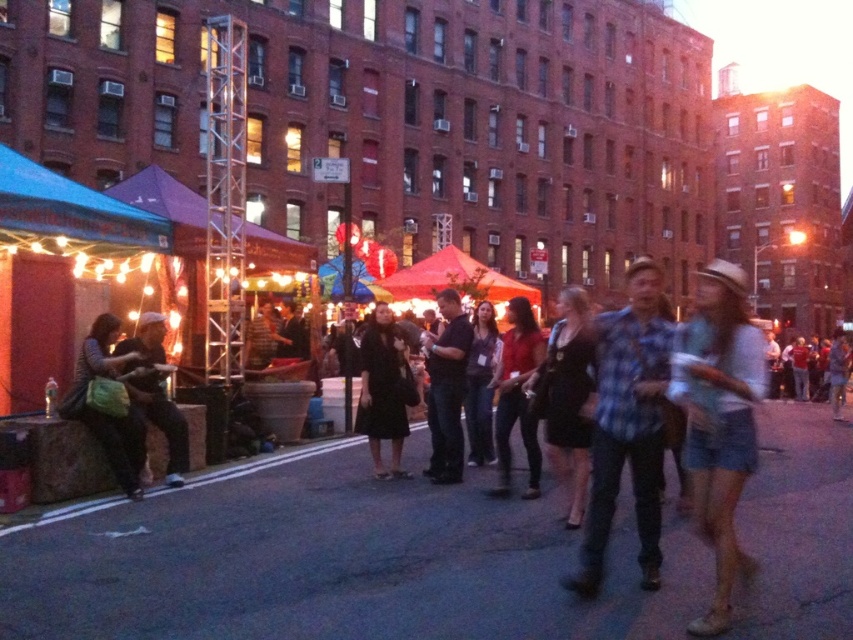
Does red fabric canopy at center have a lesser height compared to dark gray fabric jacket at center?

No, red fabric canopy at center is not shorter than dark gray fabric jacket at center.

Does red fabric canopy at center have a lesser width compared to dark gray fabric jacket at center?

In fact, red fabric canopy at center might be wider than dark gray fabric jacket at center.

You are a GUI agent. You are given a task and a screenshot of the screen. Output one action in this format:
    pyautogui.click(x=<x>, y=<y>)
    Task: Click on the red fabric canopy at center
    This screenshot has width=853, height=640.
    Given the screenshot: What is the action you would take?
    pyautogui.click(x=454, y=280)

This screenshot has width=853, height=640. In order to click on red fabric canopy at center in this screenshot , I will do `click(454, 280)`.

Which is below, blue fabric canopy at left or matte red shirt at center?

matte red shirt at center

Is blue fabric canopy at left thinner than matte red shirt at center?

Incorrect, blue fabric canopy at left's width is not less than matte red shirt at center's.

Between point (12, 180) and point (527, 476), which one is positioned in front?

Point (12, 180) is in front.

Locate an element on the screen. The image size is (853, 640). blue fabric canopy at left is located at coordinates (73, 209).

Who is taller, denim shorts at center or black matte shirt at center?

denim shorts at center is taller.

Does denim shorts at center have a larger size compared to black matte shirt at center?

Yes, denim shorts at center is bigger than black matte shirt at center.

Is point (724, 291) behind point (457, 305)?

No, it is not.

Identify the location of denim shorts at center. (718, 420).